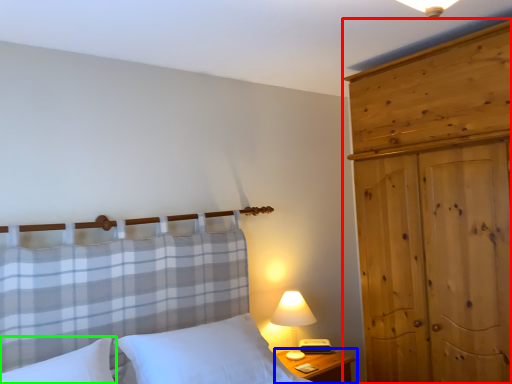
Question: Based on their relative distances, which object is nearer to dresser (highlighted by a red box)? Choose from nightstand (highlighted by a blue box) and pillow (highlighted by a green box).

Choices:
 (A) nightstand
 (B) pillow

Answer: (A)